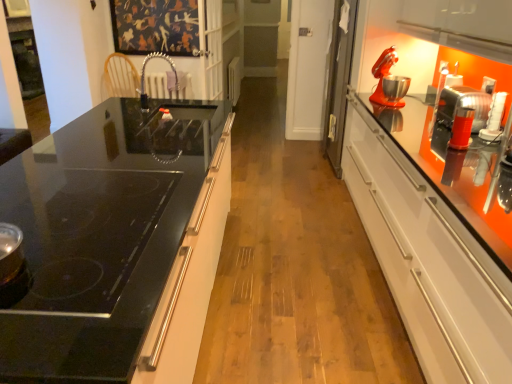
Question: In the image, is matte red mixer at upper right positioned in front of or behind black glass cooktop at left?

Choices:
 (A) behind
 (B) front

Answer: (A)

Question: From a real-world perspective, is matte red mixer at upper right physically located above or below black glass cooktop at left?

Choices:
 (A) above
 (B) below

Answer: (A)

Question: Which is nearer to the black glass cooktop at left?

Choices:
 (A) satin nickel faucet at center
 (B) matte red mixer at upper right
 (C) orange metallic mixer at right, arranged as the 2th appliance when viewed from the top
 (D) white plastic radiator at center, acting as the first appliance starting from the top

Answer: (B)

Question: Considering the real-world distances, which object is farthest from the orange metallic mixer at right, the first appliance when ordered from front to back?

Choices:
 (A) white plastic radiator at center, the first appliance when ordered from left to right
 (B) matte red mixer at upper right
 (C) black glass cooktop at left
 (D) satin nickel faucet at center

Answer: (A)